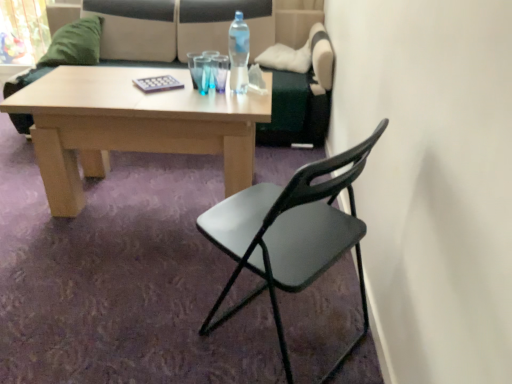
Describe the element at coordinates (220, 71) in the screenshot. I see `transparent glass at center` at that location.

Find the location of `transparent glass at center`. transparent glass at center is located at coordinates (220, 71).

This screenshot has width=512, height=384. What do you see at coordinates (239, 54) in the screenshot?
I see `clear plastic bottle at center` at bounding box center [239, 54].

Locate an element on the screen. This screenshot has width=512, height=384. green fuzzy pillow at upper left is located at coordinates (75, 44).

This screenshot has height=384, width=512. I want to click on white fabric towel at center, so click(256, 80).

Measure the distance between point [125,19] and camera.

Point [125,19] is 9.91 feet from camera.

Image resolution: width=512 pixels, height=384 pixels. Find the location of `transparent glass at center`. transparent glass at center is located at coordinates (220, 71).

Considering the sizes of objects white fabric towel at center and black plastic chair at center in the image provided, who is wider, white fabric towel at center or black plastic chair at center?

black plastic chair at center is wider.

In order to click on towel/napkin located on the left of black plastic chair at center in this screenshot , I will do `click(256, 80)`.

Considering the positions of objects white fabric towel at center and black plastic chair at center in the image provided, who is in front, white fabric towel at center or black plastic chair at center?

black plastic chair at center is more forward.

Can black plastic chair at center be found inside white fabric towel at center?

No.

Considering the sizes of transparent glass at center and white fabric towel at center in the image, is transparent glass at center wider or thinner than white fabric towel at center?

Considering their sizes, transparent glass at center looks slimmer than white fabric towel at center.

You are a GUI agent. You are given a task and a screenshot of the screen. Output one action in this format:
    pyautogui.click(x=<x>, y=<y>)
    Task: Click on the coffee cup on the left side of white fabric towel at center
    This screenshot has height=384, width=512.
    Given the screenshot: What is the action you would take?
    pyautogui.click(x=220, y=71)

From a real-world perspective, is transparent glass at center on white fabric towel at center?

Yes, from a real-world perspective, transparent glass at center is over white fabric towel at center

From the image's perspective, is beige fabric couch at upper center located above or below clear plastic bottle at center?

Clearly, from the image's perspective, beige fabric couch at upper center is above clear plastic bottle at center.

Can you see beige fabric couch at upper center touching clear plastic bottle at center?

No, beige fabric couch at upper center is not beside clear plastic bottle at center.

Between beige fabric couch at upper center and clear plastic bottle at center, which one has smaller width?

clear plastic bottle at center.

Can you confirm if beige fabric couch at upper center is shorter than clear plastic bottle at center?

No.

Considering their positions, is clear plastic bottle at center located in front of or behind beige fabric couch at upper center?

Visually, clear plastic bottle at center is located in front of beige fabric couch at upper center.

Considering the sizes of objects clear plastic bottle at center and beige fabric couch at upper center in the image provided, who is smaller, clear plastic bottle at center or beige fabric couch at upper center?

clear plastic bottle at center is smaller.

Considering the positions of point (239, 32) and point (111, 12), is point (239, 32) closer or farther from the camera than point (111, 12)?

Point (239, 32) is closer to the camera than point (111, 12).

Can you confirm if green fuzzy pillow at upper left is positioned to the left of clear plastic bottle at center?

Yes, green fuzzy pillow at upper left is to the left of clear plastic bottle at center.

From a real-world perspective, between green fuzzy pillow at upper left and clear plastic bottle at center, who is vertically higher?

In real-world perspective, clear plastic bottle at center is above.

Looking at their sizes, would you say green fuzzy pillow at upper left is wider or thinner than beige fabric couch at upper center?

In the image, green fuzzy pillow at upper left appears to be more narrow than beige fabric couch at upper center.

Image resolution: width=512 pixels, height=384 pixels. Identify the location of studio couch in front of the green fuzzy pillow at upper left. (175, 27).

From a real-world perspective, is green fuzzy pillow at upper left above or below beige fabric couch at upper center?

In terms of real-world spatial position, green fuzzy pillow at upper left is above beige fabric couch at upper center.

Is point (66, 64) in front of point (162, 56)?

Yes, it is in front of point (162, 56).

Considering the relative sizes of green fuzzy pillow at upper left and white fabric towel at center in the image provided, is green fuzzy pillow at upper left wider than white fabric towel at center?

Correct, the width of green fuzzy pillow at upper left exceeds that of white fabric towel at center.

How far apart are green fuzzy pillow at upper left and white fabric towel at center?

A distance of 1.52 meters exists between green fuzzy pillow at upper left and white fabric towel at center.

Is green fuzzy pillow at upper left turned away from white fabric towel at center?

No, white fabric towel at center is not at the back of green fuzzy pillow at upper left.

Locate an element on the screen. This screenshot has height=384, width=512. pillow lying behind the white fabric towel at center is located at coordinates (75, 44).

Find the location of a particular element. chair that appears in front of the white fabric towel at center is located at coordinates (290, 235).

You are a GUI agent. You are given a task and a screenshot of the screen. Output one action in this format:
    pyautogui.click(x=<x>, y=<y>)
    Task: Click on the coffee cup on the left of the white fabric towel at center
    This screenshot has width=512, height=384.
    Given the screenshot: What is the action you would take?
    pyautogui.click(x=220, y=71)

Looking at the image, which one is located further to clear plastic bottle at center, beige fabric couch at upper center or green fuzzy pillow at upper left?

green fuzzy pillow at upper left is further to clear plastic bottle at center.

From the image, which object appears to be farther from clear plastic bottle at center, black plastic chair at center or beige fabric couch at upper center?

beige fabric couch at upper center is further to clear plastic bottle at center.

Looking at the image, which one is located closer to beige fabric couch at upper center, transparent glass at center or white fabric towel at center?

transparent glass at center is positioned closer to the anchor beige fabric couch at upper center.

When comparing their distances from green fuzzy pillow at upper left, does beige fabric couch at upper center or white fabric towel at center seem closer?

Based on the image, beige fabric couch at upper center appears to be nearer to green fuzzy pillow at upper left.

Based on the photo, based on their spatial positions, is beige fabric couch at upper center or green fuzzy pillow at upper left further from white fabric towel at center?

green fuzzy pillow at upper left is positioned further to the anchor white fabric towel at center.

Based on their spatial positions, is white fabric towel at center or green fuzzy pillow at upper left closer to beige fabric couch at upper center?

Among the two, green fuzzy pillow at upper left is located nearer to beige fabric couch at upper center.

Which object lies nearer to the anchor point white fabric towel at center, green fuzzy pillow at upper left or beige fabric couch at upper center?

The object closer to white fabric towel at center is beige fabric couch at upper center.

Looking at the image, which one is located closer to beige fabric couch at upper center, transparent glass at center or black plastic chair at center?

transparent glass at center.

At what (x,y) coordinates should I click in order to perform the action: click on coffee cup between black plastic chair at center and beige fabric couch at upper center from front to back. Please return your answer as a coordinate pair (x, y). The image size is (512, 384). Looking at the image, I should click on (220, 71).

Image resolution: width=512 pixels, height=384 pixels. In order to click on bottle situated between green fuzzy pillow at upper left and white fabric towel at center from left to right in this screenshot , I will do `click(239, 54)`.

Where is `coffee cup between green fuzzy pillow at upper left and clear plastic bottle at center`? Image resolution: width=512 pixels, height=384 pixels. coffee cup between green fuzzy pillow at upper left and clear plastic bottle at center is located at coordinates (220, 71).

Where is `bottle located between transparent glass at center and white fabric towel at center in the left-right direction`? bottle located between transparent glass at center and white fabric towel at center in the left-right direction is located at coordinates (239, 54).